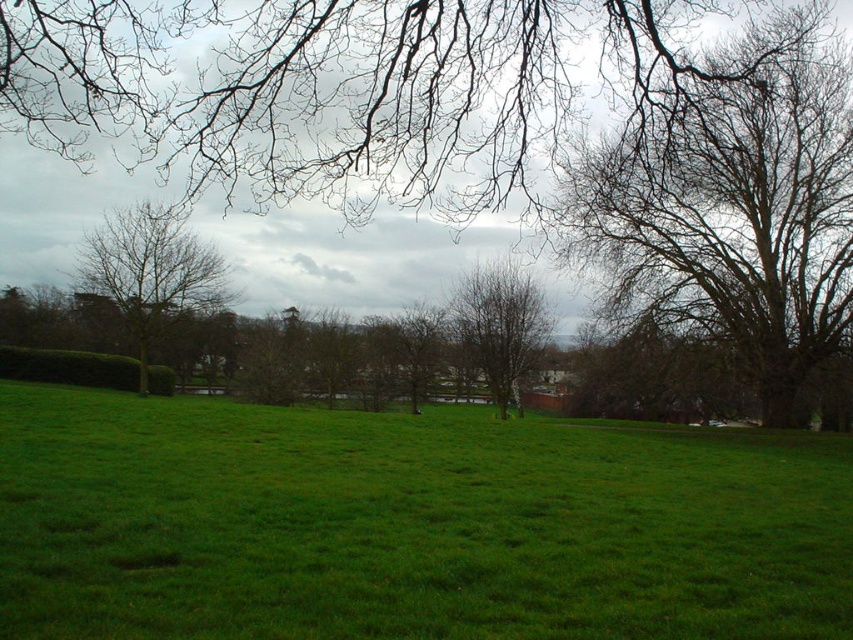
Is bare branches at upper center smaller than bare branches at upper right?

No, bare branches at upper center is not smaller than bare branches at upper right.

Which of these two, bare branches at upper center or bare branches at upper right, stands taller?

Standing taller between the two is bare branches at upper right.

Is point (244, 140) behind point (838, 128)?

No, (244, 140) is in front of (838, 128).

Where is `bare branches at upper center`? The image size is (853, 640). bare branches at upper center is located at coordinates (337, 88).

Is point (62, 22) farther from viewer compared to point (100, 244)?

No, it is not.

Is bare branches at upper center in front of bare branches at left?

Yes, it is.

Between point (161, 24) and point (172, 276), which one is positioned behind?

The point (172, 276) is more distant.

You are a GUI agent. You are given a task and a screenshot of the screen. Output one action in this format:
    pyautogui.click(x=<x>, y=<y>)
    Task: Click on the bare branches at upper center
    
    Given the screenshot: What is the action you would take?
    [337, 88]

Which is more to the right, green grassy field at center or bare branches at upper right?

From the viewer's perspective, bare branches at upper right appears more on the right side.

Does green grassy field at center have a lesser height compared to bare branches at upper right?

Yes.

Does point (358, 518) come behind point (720, 74)?

No.

Locate an element on the screen. The width and height of the screenshot is (853, 640). green grassy field at center is located at coordinates [x=408, y=525].